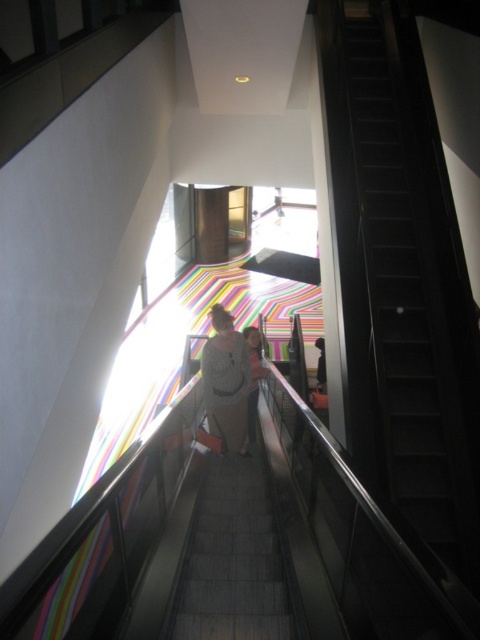
Who is lower down, dark gray concrete stairs at center or white textured shirt at center?

dark gray concrete stairs at center is below.

Measure the distance between point (211, 628) and camera.

Point (211, 628) and camera are 8.04 feet apart.

Does point (231, 488) come behind point (204, 388)?

No, it is not.

Image resolution: width=480 pixels, height=640 pixels. I want to click on dark gray concrete stairs at center, so pyautogui.click(x=231, y=561).

Is black metal stairs at upper right taller than white textured shirt at center?

Yes.

Does point (455, 435) come in front of point (212, 384)?

Yes, point (455, 435) is in front of point (212, 384).

Locate an element on the screen. Image resolution: width=480 pixels, height=640 pixels. black metal stairs at upper right is located at coordinates (415, 285).

This screenshot has height=640, width=480. Find the location of `black metal stairs at upper right`. black metal stairs at upper right is located at coordinates (415, 285).

Does black metal stairs at upper right have a smaller size compared to dark gray concrete stairs at center?

No.

Is point (385, 260) positioned in front of point (241, 580)?

No.

Which is behind, point (423, 465) or point (214, 589)?

Positioned behind is point (423, 465).

Where is `black metal stairs at upper right`? The image size is (480, 640). black metal stairs at upper right is located at coordinates (415, 285).